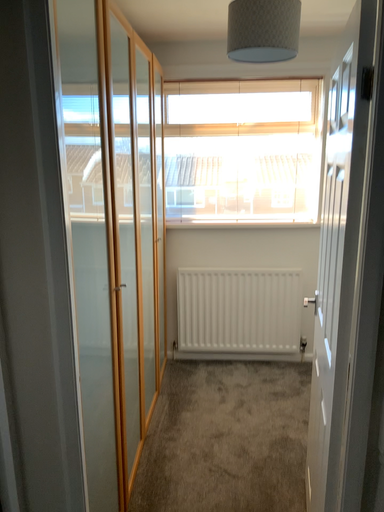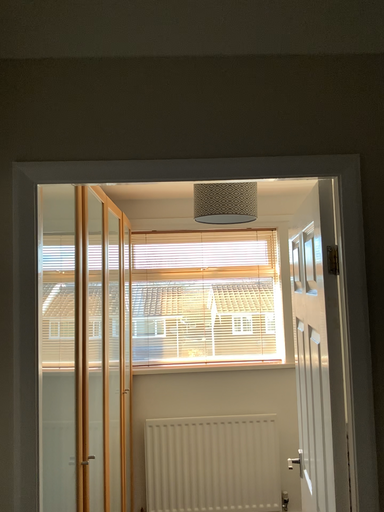
Question: How did the camera likely rotate when shooting the video?

Choices:
 (A) rotated upward
 (B) rotated downward

Answer: (A)